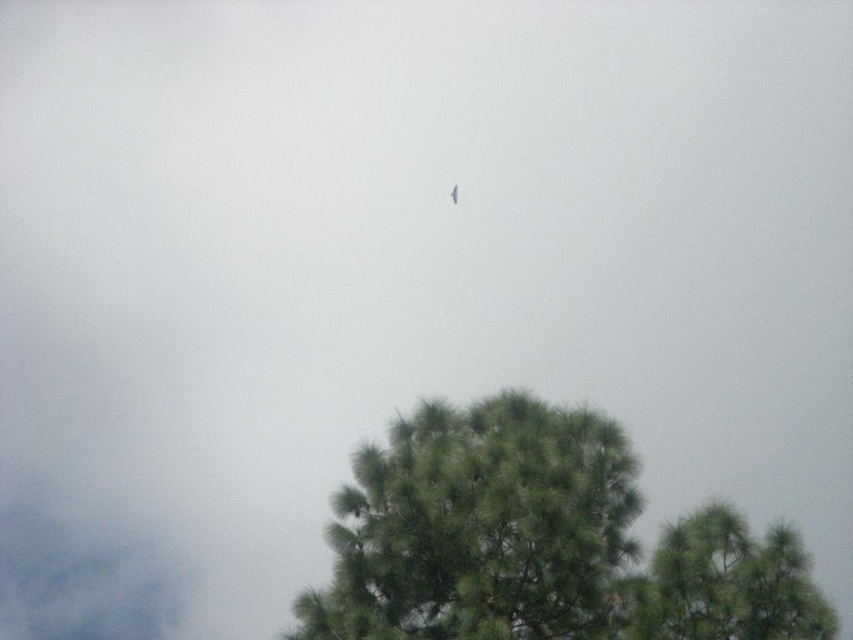
In the scene shown: Who is lower down, green fuzzy tree at center or gray fluffy cloud at upper left?

gray fluffy cloud at upper left is lower down.

Image resolution: width=853 pixels, height=640 pixels. I want to click on green fuzzy tree at center, so click(x=480, y=528).

Does point (119, 611) come behind point (451, 202)?

Yes, it is.

Can you confirm if gray fluffy cloud at upper left is bigger than dark gray feathered bird at center?

Yes.

You are a GUI agent. You are given a task and a screenshot of the screen. Output one action in this format:
    pyautogui.click(x=<x>, y=<y>)
    Task: Click on the gray fluffy cloud at upper left
    This screenshot has width=853, height=640.
    Given the screenshot: What is the action you would take?
    pyautogui.click(x=78, y=573)

Is green fuzzy tree at center behind dark gray feathered bird at center?

No, green fuzzy tree at center is closer to the viewer.

Between green fuzzy tree at center and dark gray feathered bird at center, which one is positioned lower?

green fuzzy tree at center is lower down.

Who is more forward, (595, 566) or (451, 195)?

Positioned in front is point (595, 566).

This screenshot has width=853, height=640. Find the location of `green fuzzy tree at center`. green fuzzy tree at center is located at coordinates (480, 528).